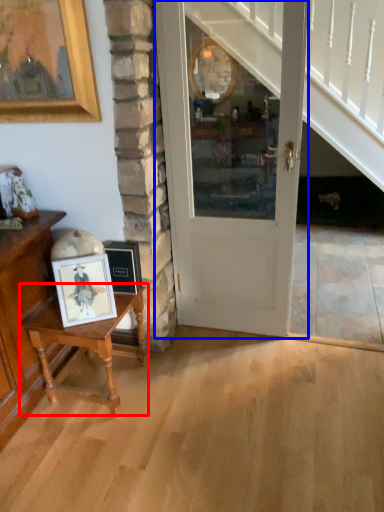
Question: Which of the following is the farthest to the observer, table (highlighted by a red box) or door (highlighted by a blue box)?

Choices:
 (A) table
 (B) door

Answer: (A)